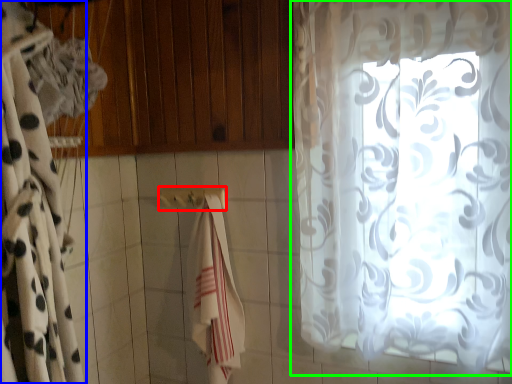
Question: Which is nearer to the towel bar (highlighted by a red box)? curtain (highlighted by a blue box) or curtain (highlighted by a green box).

Choices:
 (A) curtain
 (B) curtain

Answer: (A)